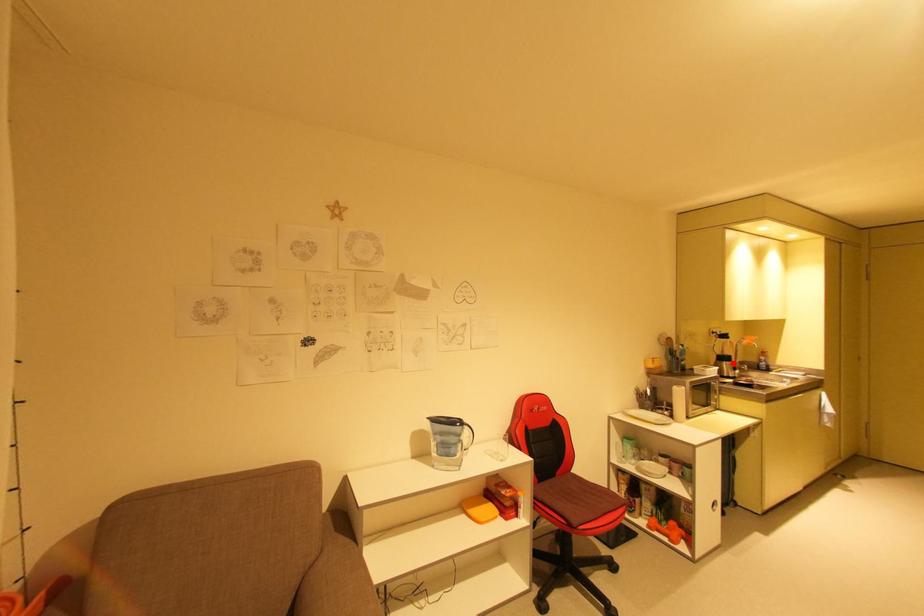
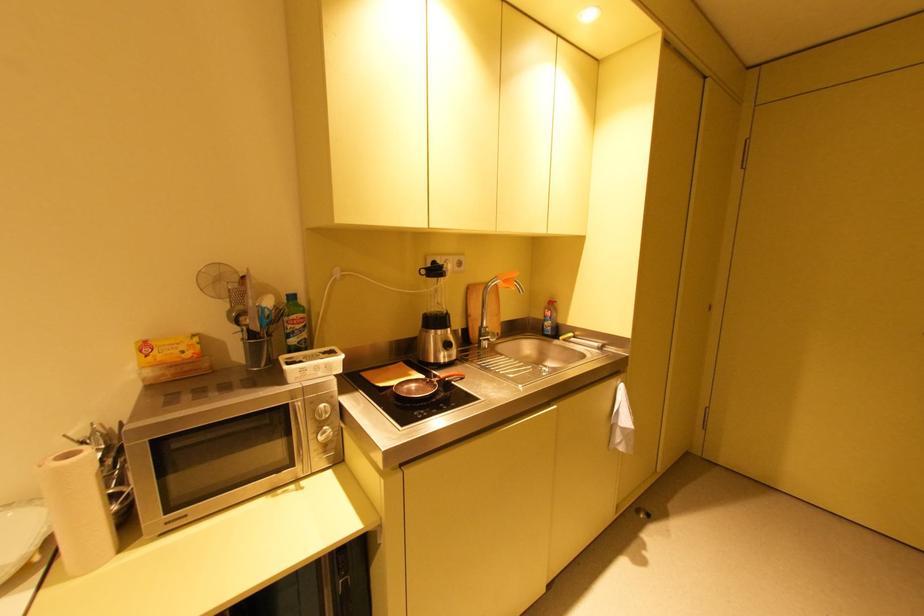
Where in the second image is the point corresponding to the highlighted location from the first image?

(444, 331)